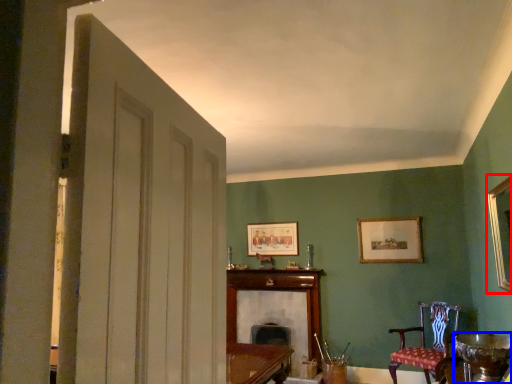
Question: Among these objects, which one is farthest to the camera, picture frame (highlighted by a red box) or round table (highlighted by a blue box)?

Choices:
 (A) picture frame
 (B) round table

Answer: (B)